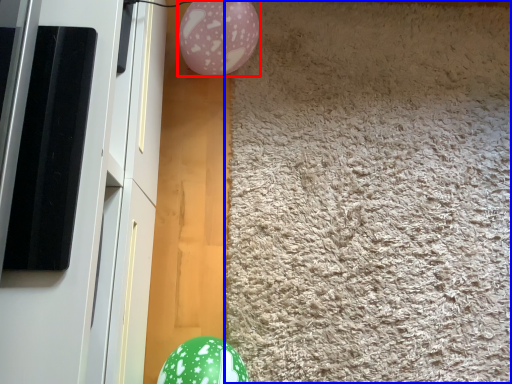
Question: Which point is closer to the camera, balloon (highlighted by a red box) or mat (highlighted by a blue box)?

Choices:
 (A) balloon
 (B) mat

Answer: (B)